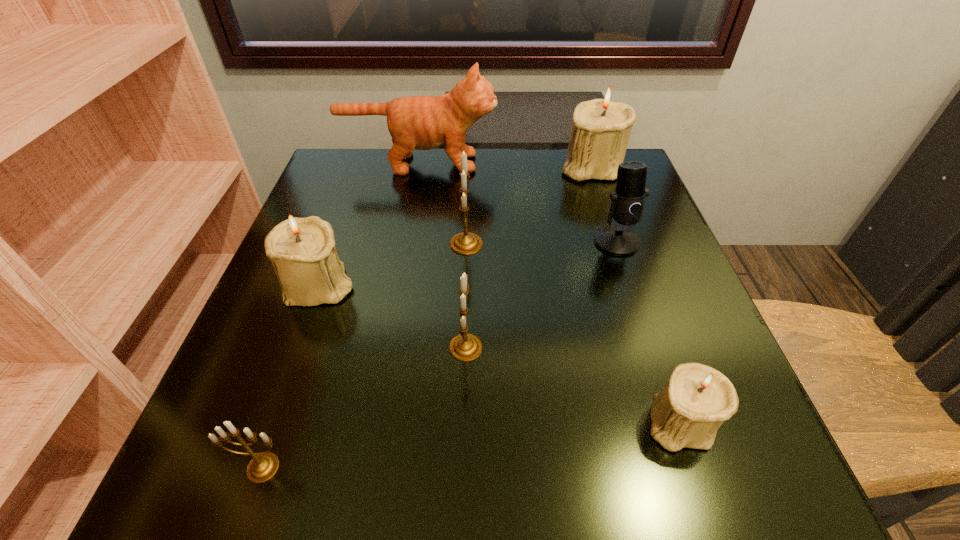
The height and width of the screenshot is (540, 960). In order to click on cat that is at the far edge in this screenshot , I will do `click(418, 122)`.

This screenshot has height=540, width=960. Identify the location of candle_holder that is at the far edge. (601, 129).

You are a GUI agent. You are given a task and a screenshot of the screen. Output one action in this format:
    pyautogui.click(x=<x>, y=<y>)
    Task: Click on the cat located at the left edge
    
    Given the screenshot: What is the action you would take?
    pyautogui.click(x=418, y=122)

At what (x,y) coordinates should I click in order to perform the action: click on microphone that is at the right edge. Please return your answer as a coordinate pair (x, y). Image resolution: width=960 pixels, height=540 pixels. Looking at the image, I should click on (627, 204).

Locate an element on the screen. The height and width of the screenshot is (540, 960). object that is at the far left corner is located at coordinates tap(418, 122).

Find the location of a particular element. The width and height of the screenshot is (960, 540). object at the near left corner is located at coordinates (262, 467).

You are a GUI agent. You are given a task and a screenshot of the screen. Output one action in this format:
    pyautogui.click(x=<x>, y=<y>)
    Task: Click on the object that is at the far right corner
    This screenshot has width=960, height=540.
    Given the screenshot: What is the action you would take?
    pyautogui.click(x=601, y=129)

I want to click on object that is at the near right corner, so click(x=695, y=401).

At what (x,y) coordinates should I click in order to perform the action: click on vacant region at the far edge of the desktop. Please return your answer as a coordinate pair (x, y). The width and height of the screenshot is (960, 540). Looking at the image, I should click on (437, 171).

In the image, there is a desktop. In order to click on vacant space at the near edge in this screenshot , I will do `click(400, 490)`.